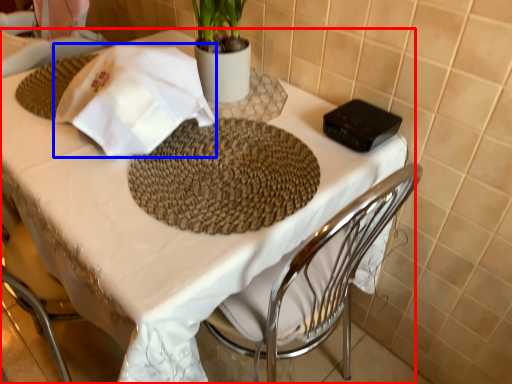
Question: Which of the following is the closest to the observer, table (highlighted by a red box) or cloth (highlighted by a blue box)?

Choices:
 (A) table
 (B) cloth

Answer: (A)